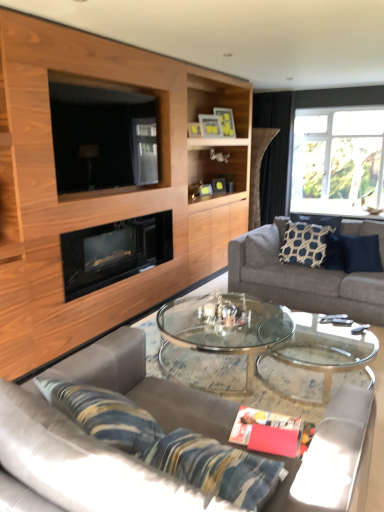
Locate an element on the screen. black glass wood burning stove at center is located at coordinates (114, 252).

Measure the distance between black glass wood burning stove at center and camera.

They are 2.97 meters apart.

What is the approximate width of matte yellow picture frame at upper center, marked as the first picture frame in a back-to-front arrangement?

matte yellow picture frame at upper center, marked as the first picture frame in a back-to-front arrangement, is 13.33 centimeters wide.

The height and width of the screenshot is (512, 384). Describe the element at coordinates (360, 253) in the screenshot. I see `dark blue fabric pillow at right, positioned as the second pillow in left-to-right order` at that location.

Find the location of a particular element. The width and height of the screenshot is (384, 512). gray fabric couch at right, the 1th studio couch when ordered from back to front is located at coordinates (301, 279).

Image resolution: width=384 pixels, height=512 pixels. What do you see at coordinates (273, 151) in the screenshot? I see `black fabric curtain at upper right` at bounding box center [273, 151].

The image size is (384, 512). Identify the location of black fabric curtain at upper right. (273, 151).

I want to click on black glass tv at upper left, so pyautogui.click(x=102, y=137).

Looking at their sizes, would you say navy blue textured pillow at right, which appears as the 2th pillow when viewed from the right, is wider or thinner than wooden cabinet at upper left?

Considering their sizes, navy blue textured pillow at right, which appears as the 2th pillow when viewed from the right, looks slimmer than wooden cabinet at upper left.

Is navy blue textured pillow at right, which is the first pillow in left-to-right order, beside wooden cabinet at upper left?

No, navy blue textured pillow at right, which is the first pillow in left-to-right order, is not in contact with wooden cabinet at upper left.

From the image's perspective, does navy blue textured pillow at right, which appears as the 2th pillow when viewed from the right, appear higher than wooden cabinet at upper left?

Incorrect, from the image's perspective, navy blue textured pillow at right, which appears as the 2th pillow when viewed from the right, is lower than wooden cabinet at upper left.

Is navy blue textured pillow at right, which is the first pillow in left-to-right order, spatially inside wooden cabinet at upper left, or outside of it?

navy blue textured pillow at right, which is the first pillow in left-to-right order, exists outside the volume of wooden cabinet at upper left.

Between wooden cabinet at upper left and leather couch at center, marked as the 2th studio couch in a right-to-left arrangement, which one has larger width?

Wider between the two is leather couch at center, marked as the 2th studio couch in a right-to-left arrangement.

Does wooden cabinet at upper left have a larger size compared to leather couch at center, which ranks as the first studio couch in front-to-back order?

Indeed, wooden cabinet at upper left has a larger size compared to leather couch at center, which ranks as the first studio couch in front-to-back order.

Can you tell me how much wooden cabinet at upper left and leather couch at center, which appears as the 1th studio couch when viewed from the left, differ in facing direction?

wooden cabinet at upper left and leather couch at center, which appears as the 1th studio couch when viewed from the left, are facing 91.5 degrees away from each other.

From a real-world perspective, between wooden cabinet at upper left and leather couch at center, marked as the 2th studio couch in a right-to-left arrangement, who is vertically lower?

leather couch at center, marked as the 2th studio couch in a right-to-left arrangement, is physically lower.

Is gray fabric couch at right, arranged as the first studio couch when viewed from the right, aimed at matte yellow picture frame at upper center, arranged as the 3th picture frame when viewed from the front?

No, gray fabric couch at right, arranged as the first studio couch when viewed from the right, is not aimed at matte yellow picture frame at upper center, arranged as the 3th picture frame when viewed from the front.

Who is bigger, gray fabric couch at right, which appears as the 2th studio couch when viewed from the left, or matte yellow picture frame at upper center, marked as the first picture frame in a back-to-front arrangement?

gray fabric couch at right, which appears as the 2th studio couch when viewed from the left.

Can you confirm if gray fabric couch at right, which appears as the 2th studio couch when viewed from the left, is positioned to the right of matte yellow picture frame at upper center, arranged as the 3th picture frame when viewed from the front?

Correct, you'll find gray fabric couch at right, which appears as the 2th studio couch when viewed from the left, to the right of matte yellow picture frame at upper center, arranged as the 3th picture frame when viewed from the front.

In order to click on studio couch to the right of matte yellow picture frame at upper center, marked as the first picture frame in a back-to-front arrangement in this screenshot , I will do `click(301, 279)`.

Can you confirm if matte gold picture frame at upper center, the third picture frame when ordered from back to front, is thinner than wooden cabinet at upper left?

Indeed, matte gold picture frame at upper center, the third picture frame when ordered from back to front, has a lesser width compared to wooden cabinet at upper left.

Is wooden cabinet at upper left a part of matte gold picture frame at upper center, the third picture frame when ordered from back to front?

No, wooden cabinet at upper left is located outside of matte gold picture frame at upper center, the third picture frame when ordered from back to front.

Considering the relative sizes of matte gold picture frame at upper center, the third picture frame when ordered from back to front, and wooden cabinet at upper left in the image provided, is matte gold picture frame at upper center, the third picture frame when ordered from back to front, smaller than wooden cabinet at upper left?

Indeed, matte gold picture frame at upper center, the third picture frame when ordered from back to front, has a smaller size compared to wooden cabinet at upper left.

Which is more distant, (196,122) or (167,167)?

The point (196,122) is behind.

From the image's perspective, is wooden cabinet at upper left located beneath black glass wood burning stove at center?

No, from the image's perspective, wooden cabinet at upper left is not below black glass wood burning stove at center.

Considering the sizes of objects wooden cabinet at upper left and black glass wood burning stove at center in the image provided, who is bigger, wooden cabinet at upper left or black glass wood burning stove at center?

Bigger between the two is wooden cabinet at upper left.

This screenshot has width=384, height=512. I want to click on cabinetry on the right of black glass wood burning stove at center, so (x=102, y=191).

From a real-world perspective, which is physically below, wooden cabinet at upper left or black glass wood burning stove at center?

black glass wood burning stove at center.

Between dark blue fabric pillow at right, the first pillow positioned from the right, and navy blue textured pillow at right, which appears as the 2th pillow when viewed from the right, which one has less height?

dark blue fabric pillow at right, the first pillow positioned from the right.

Is dark blue fabric pillow at right, the first pillow positioned from the right, smaller than navy blue textured pillow at right, which is the first pillow in left-to-right order?

Yes, dark blue fabric pillow at right, the first pillow positioned from the right, is smaller than navy blue textured pillow at right, which is the first pillow in left-to-right order.

Is navy blue textured pillow at right, which appears as the 2th pillow when viewed from the right, at the back of dark blue fabric pillow at right, positioned as the second pillow in left-to-right order?

dark blue fabric pillow at right, positioned as the second pillow in left-to-right order, does not have its back to navy blue textured pillow at right, which appears as the 2th pillow when viewed from the right.

Between dark blue fabric pillow at right, positioned as the second pillow in left-to-right order, and navy blue textured pillow at right, which is the first pillow in left-to-right order, which one appears on the left side from the viewer's perspective?

From the viewer's perspective, navy blue textured pillow at right, which is the first pillow in left-to-right order, appears more on the left side.

Considering the relative sizes of clear glass window at upper right and matte gold picture frame at upper center, the 1th picture frame when ordered from front to back, in the image provided, is clear glass window at upper right bigger than matte gold picture frame at upper center, the 1th picture frame when ordered from front to back,?

Yes, clear glass window at upper right is bigger than matte gold picture frame at upper center, the 1th picture frame when ordered from front to back.

Which is in front, clear glass window at upper right or matte gold picture frame at upper center, the third picture frame when ordered from back to front?

matte gold picture frame at upper center, the third picture frame when ordered from back to front.

Would you say clear glass window at upper right is inside or outside matte gold picture frame at upper center, the third picture frame when ordered from back to front?

clear glass window at upper right is not enclosed by matte gold picture frame at upper center, the third picture frame when ordered from back to front.

From the image's perspective, is clear glass window at upper right located above or below matte gold picture frame at upper center, the third picture frame when ordered from back to front?

From the image's perspective, clear glass window at upper right appears above matte gold picture frame at upper center, the third picture frame when ordered from back to front.

You are a GUI agent. You are given a task and a screenshot of the screen. Output one action in this format:
    pyautogui.click(x=<x>, y=<y>)
    Task: Click on the cabinetry located above the navy blue textured pillow at right, which is the first pillow in left-to-right order (from the image's perspective)
    This screenshot has height=512, width=384.
    Given the screenshot: What is the action you would take?
    pyautogui.click(x=102, y=191)

Find the location of a particular element. Image resolution: width=384 pixels, height=512 pixels. studio couch in front of the wooden cabinet at upper left is located at coordinates (63, 455).

Consider the image. Considering their positions, is black glass tv at upper left positioned further to wooden cabinet at upper left than gray fabric couch at right, which appears as the 2th studio couch when viewed from the left?

Among the two, gray fabric couch at right, which appears as the 2th studio couch when viewed from the left, is located further to wooden cabinet at upper left.

When comparing their distances from clear glass window at upper right, does wooden picture frame at upper center, which is the 2th picture frame in back-to-front order, or navy blue textured pillow at right, which is the first pillow in left-to-right order, seem closer?

Among the two, wooden picture frame at upper center, which is the 2th picture frame in back-to-front order, is located nearer to clear glass window at upper right.

Which object lies nearer to the anchor point leather couch at center, which appears as the 1th studio couch when viewed from the left, matte gold picture frame at upper center, the 1th picture frame when ordered from front to back, or dark blue fabric pillow at right, positioned as the second pillow in left-to-right order?

Among the two, dark blue fabric pillow at right, positioned as the second pillow in left-to-right order, is located nearer to leather couch at center, which appears as the 1th studio couch when viewed from the left.

When comparing their distances from wooden cabinet at upper left, does matte yellow picture frame at upper center, marked as the first picture frame in a back-to-front arrangement, or matte gold picture frame at upper center, the 1th picture frame when ordered from front to back, seem closer?

The object closer to wooden cabinet at upper left is matte gold picture frame at upper center, the 1th picture frame when ordered from front to back.

Considering their positions, is gray fabric couch at right, the 1th studio couch when ordered from back to front, positioned further to navy blue textured pillow at right, which is the first pillow in left-to-right order, than matte yellow picture frame at upper center, arranged as the 3th picture frame when viewed from the front?

Among the two, matte yellow picture frame at upper center, arranged as the 3th picture frame when viewed from the front, is located further to navy blue textured pillow at right, which is the first pillow in left-to-right order.

Based on their spatial positions, is wooden picture frame at upper center, which is the 2th picture frame in back-to-front order, or dark blue fabric pillow at right, the first pillow positioned from the right, further from leather couch at center, marked as the 2th studio couch in a right-to-left arrangement?

Among the two, wooden picture frame at upper center, which is the 2th picture frame in back-to-front order, is located further to leather couch at center, marked as the 2th studio couch in a right-to-left arrangement.

Which object lies further to the anchor point black glass wood burning stove at center, black fabric curtain at upper right or leather couch at center, marked as the 2th studio couch in a right-to-left arrangement?

black fabric curtain at upper right lies further to black glass wood burning stove at center than the other object.

Looking at the image, which one is located further to leather couch at center, marked as the 2th studio couch in a right-to-left arrangement, matte gold picture frame at upper center, the third picture frame when ordered from back to front, or black fabric curtain at upper right?

The object further to leather couch at center, marked as the 2th studio couch in a right-to-left arrangement, is black fabric curtain at upper right.

Find the location of a particular element. cabinetry situated between black glass wood burning stove at center and navy blue textured pillow at right, which appears as the 2th pillow when viewed from the right, from left to right is located at coordinates (102, 191).

Find the location of `picture frame between wooden cabinet at upper left and wooden picture frame at upper center, which ranks as the 2th picture frame in front-to-back order, in the front-back direction`. picture frame between wooden cabinet at upper left and wooden picture frame at upper center, which ranks as the 2th picture frame in front-to-back order, in the front-back direction is located at coordinates (193, 129).

Where is `window screen located between wooden cabinet at upper left and matte yellow picture frame at upper center, marked as the first picture frame in a back-to-front arrangement, in the depth direction`? The image size is (384, 512). window screen located between wooden cabinet at upper left and matte yellow picture frame at upper center, marked as the first picture frame in a back-to-front arrangement, in the depth direction is located at coordinates (102, 137).

Locate an element on the screen. This screenshot has height=512, width=384. studio couch between wooden cabinet at upper left and wooden picture frame at upper center, which ranks as the 2th picture frame in front-to-back order, from front to back is located at coordinates (301, 279).